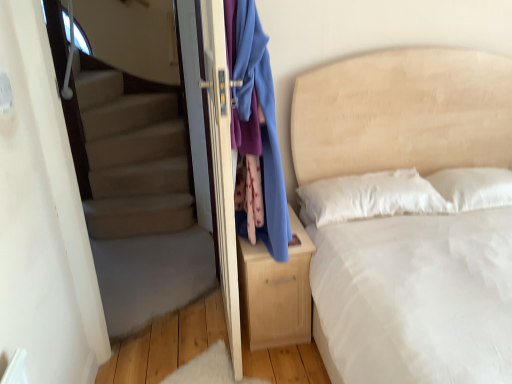
Question: Should I look upward or downward to see blue fabric at center?

Choices:
 (A) down
 (B) up

Answer: (B)

Question: From the image's perspective, is matte white screen door at center above light wood nightstand at center?

Choices:
 (A) yes
 (B) no

Answer: (A)

Question: Is light wood nightstand at center a part of matte white screen door at center?

Choices:
 (A) yes
 (B) no

Answer: (B)

Question: Can we say matte white screen door at center lies outside light wood nightstand at center?

Choices:
 (A) no
 (B) yes

Answer: (B)

Question: Is matte white screen door at center wider than light wood nightstand at center?

Choices:
 (A) yes
 (B) no

Answer: (B)

Question: From the image's perspective, is matte white screen door at center located beneath light wood nightstand at center?

Choices:
 (A) no
 (B) yes

Answer: (A)

Question: Does matte white screen door at center have a lesser width compared to light wood nightstand at center?

Choices:
 (A) no
 (B) yes

Answer: (B)

Question: Is light wood nightstand at center facing away from blue fabric at center?

Choices:
 (A) yes
 (B) no

Answer: (B)

Question: Does light wood nightstand at center have a lesser height compared to blue fabric at center?

Choices:
 (A) yes
 (B) no

Answer: (A)

Question: From the image's perspective, is light wood nightstand at center on blue fabric at center?

Choices:
 (A) yes
 (B) no

Answer: (B)

Question: Is light wood nightstand at center next to blue fabric at center and touching it?

Choices:
 (A) yes
 (B) no

Answer: (B)

Question: Are light wood nightstand at center and blue fabric at center far apart?

Choices:
 (A) no
 (B) yes

Answer: (A)

Question: Can you confirm if light wood nightstand at center is positioned to the left of blue fabric at center?

Choices:
 (A) yes
 (B) no

Answer: (B)

Question: From a real-world perspective, does beige fabric bed at center stand above carpeted stairs at left?

Choices:
 (A) no
 (B) yes

Answer: (A)